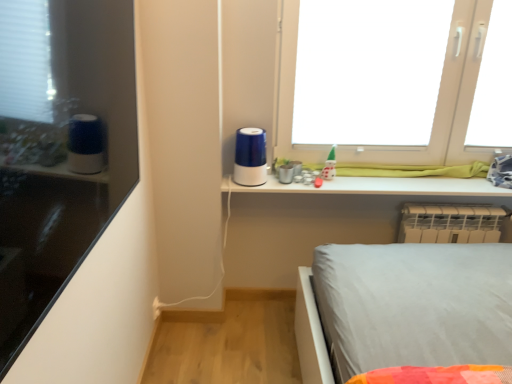
Question: In terms of size, does matte black shelf at left appear bigger or smaller than white plastic window at upper right?

Choices:
 (A) big
 (B) small

Answer: (B)

Question: Is matte black shelf at left to the left or to the right of white plastic window at upper right in the image?

Choices:
 (A) left
 (B) right

Answer: (A)

Question: Estimate the real-world distances between objects in this image. Which object is farther from the matte black shelf at left?

Choices:
 (A) white plastic radiator at lower right
 (B) green glossy toy at upper center
 (C) transparent plastic window screen at upper right
 (D) white plastic window at upper right
 (E) blue glossy humidifier at center

Answer: (C)

Question: Estimate the real-world distances between objects in this image. Which object is closer to the white plastic radiator at lower right?

Choices:
 (A) blue glossy humidifier at center
 (B) transparent plastic window screen at upper right
 (C) green glossy toy at upper center
 (D) white plastic window at upper right
 (E) matte black shelf at left

Answer: (D)